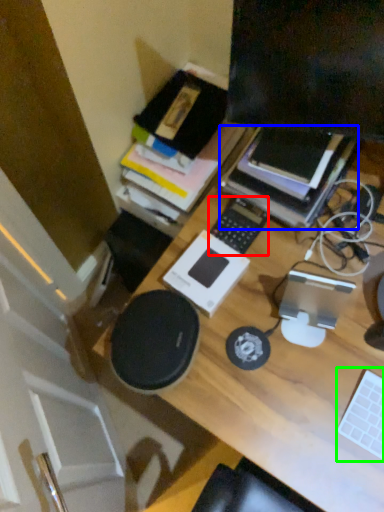
Question: Based on their relative distances, which object is farther from laptop keyboard (highlighted by a red box)? Choose from paperback book (highlighted by a blue box) and laptop keyboard (highlighted by a green box).

Choices:
 (A) paperback book
 (B) laptop keyboard

Answer: (B)